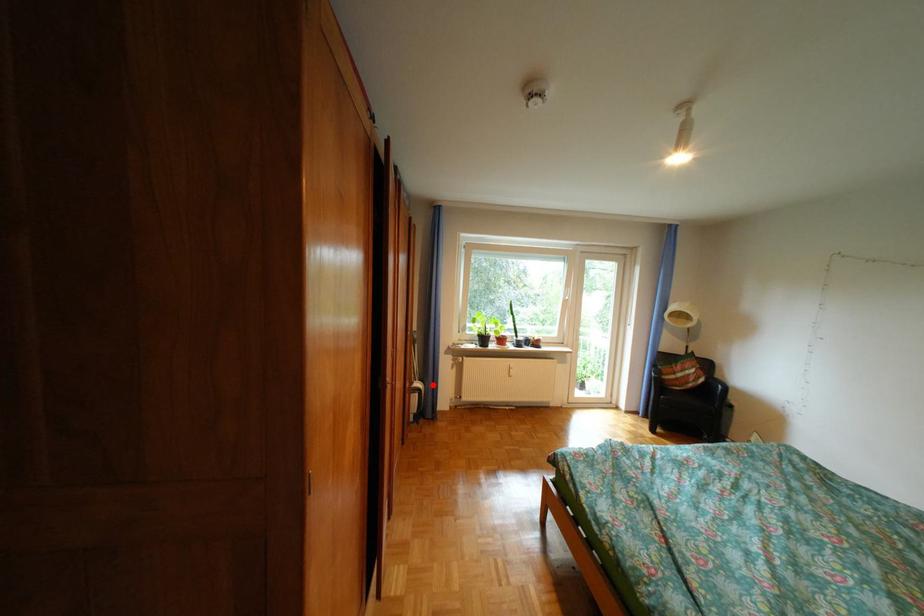
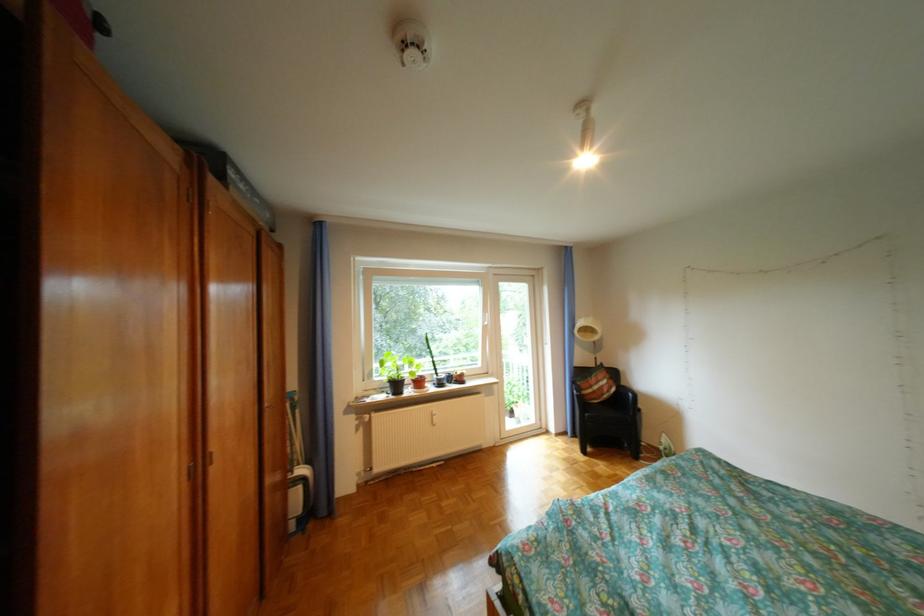
Question: I am providing you with two images of the same scene from different viewpoints. Given a red point in image1, look at the same physical point in image2. Is it:

Choices:
 (A) Closer to the viewpoint
 (B) Farther from the viewpoint

Answer: (A)